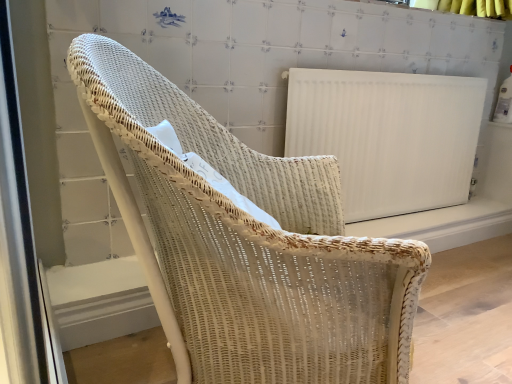
I want to click on white wicker chair at center, so click(246, 243).

Describe the element at coordinates (246, 243) in the screenshot. The height and width of the screenshot is (384, 512). I see `white wicker chair at center` at that location.

Measure the distance between white wicker chair at center and camera.

The depth of white wicker chair at center is 21.46 inches.

What is the approximate width of white wicker chair at center?

white wicker chair at center is 25.12 inches wide.

At what (x,y) coordinates should I click in order to perform the action: click on white ribbed radiator at upper right. Please return your answer as a coordinate pair (x, y). The height and width of the screenshot is (384, 512). Looking at the image, I should click on (388, 135).

What do you see at coordinates (388, 135) in the screenshot?
I see `white ribbed radiator at upper right` at bounding box center [388, 135].

At what (x,y) coordinates should I click in order to perform the action: click on white wicker chair at center. Please return your answer as a coordinate pair (x, y). This screenshot has width=512, height=384. Looking at the image, I should click on (246, 243).

Considering the relative positions of white ribbed radiator at upper right and white wicker chair at center in the image provided, is white ribbed radiator at upper right to the left of white wicker chair at center from the viewer's perspective?

Incorrect, white ribbed radiator at upper right is not on the left side of white wicker chair at center.

Does white ribbed radiator at upper right come behind white wicker chair at center?

That is True.

Is point (349, 159) behind point (303, 286)?

Yes, point (349, 159) is farther from viewer.

From the image's perspective, which one is positioned higher, white ribbed radiator at upper right or white wicker chair at center?

Answer: white ribbed radiator at upper right, from the image's perspective.

From a real-world perspective, is white ribbed radiator at upper right above or below white wicker chair at center?

white ribbed radiator at upper right is situated higher than white wicker chair at center in the real world.

Which object is wider, white ribbed radiator at upper right or white wicker chair at center?

With larger width is white wicker chair at center.

In terms of height, does white ribbed radiator at upper right look taller or shorter compared to white wicker chair at center?

white ribbed radiator at upper right is shorter than white wicker chair at center.

Can you confirm if white ribbed radiator at upper right is smaller than white wicker chair at center?

Correct, white ribbed radiator at upper right occupies less space than white wicker chair at center.

Is white ribbed radiator at upper right completely or partially outside of white wicker chair at center?

Yes, white ribbed radiator at upper right is not within white wicker chair at center.

Are white ribbed radiator at upper right and white wicker chair at center beside each other?

There is a gap between white ribbed radiator at upper right and white wicker chair at center.

Is white ribbed radiator at upper right turned away from white wicker chair at center?

No.

Where is `chair located in front of the white ribbed radiator at upper right`? Image resolution: width=512 pixels, height=384 pixels. chair located in front of the white ribbed radiator at upper right is located at coordinates (246, 243).

Considering the positions of objects white wicker chair at center and white ribbed radiator at upper right in the image provided, who is more to the right, white wicker chair at center or white ribbed radiator at upper right?

From the viewer's perspective, white ribbed radiator at upper right appears more on the right side.

From the picture: Is white wicker chair at center further to the viewer compared to white ribbed radiator at upper right?

No.

Which is behind, point (401, 282) or point (448, 126)?

The point (448, 126) is farther.

From the image's perspective, is white wicker chair at center below white ribbed radiator at upper right?

Yes.

From a real-world perspective, which object stands above the other?

white ribbed radiator at upper right is physically above.

Between white wicker chair at center and white ribbed radiator at upper right, which one has larger width?

With larger width is white wicker chair at center.

Between white wicker chair at center and white ribbed radiator at upper right, which one has more height?

white wicker chair at center.

Does white wicker chair at center have a smaller size compared to white ribbed radiator at upper right?

Incorrect, white wicker chair at center is not smaller in size than white ribbed radiator at upper right.

Is white wicker chair at center not inside white ribbed radiator at upper right?

Yes, white wicker chair at center is not within white ribbed radiator at upper right.

In the scene shown: Are white wicker chair at center and white ribbed radiator at upper right making contact?

No, white wicker chair at center is not touching white ribbed radiator at upper right.

Is white wicker chair at center positioned with its back to white ribbed radiator at upper right?

No, white wicker chair at center is not facing away from white ribbed radiator at upper right.

What's the angular difference between white wicker chair at center and white ribbed radiator at upper right's facing directions?

The angle between the facing direction of white wicker chair at center and the facing direction of white ribbed radiator at upper right is 64.1 degrees.

You are a GUI agent. You are given a task and a screenshot of the screen. Output one action in this format:
    pyautogui.click(x=<x>, y=<y>)
    Task: Click on the radiator positioned vertically above the white wicker chair at center (from a real-world perspective)
    This screenshot has width=512, height=384.
    Given the screenshot: What is the action you would take?
    pyautogui.click(x=388, y=135)

Identify the location of radiator behind the white wicker chair at center. The height and width of the screenshot is (384, 512). (388, 135).

Locate an element on the screen. The width and height of the screenshot is (512, 384). radiator to the right of white wicker chair at center is located at coordinates (388, 135).